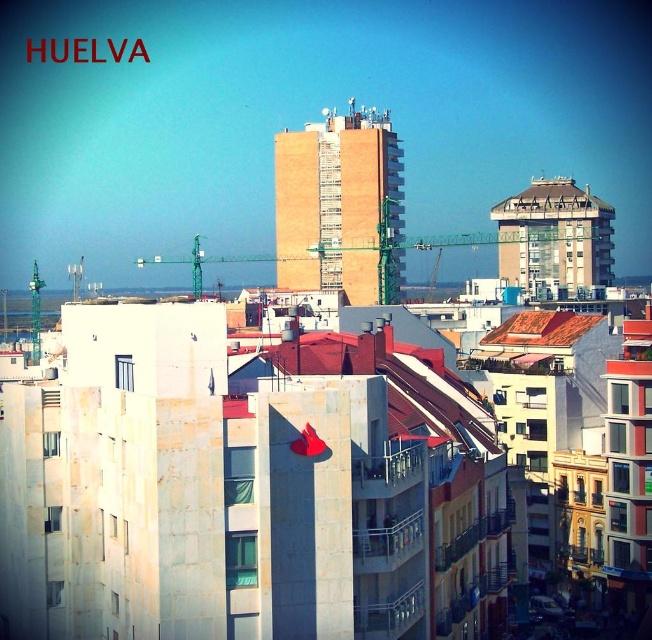
Measure the distance between point (381, 113) and camera.

The distance of point (381, 113) from camera is 1214.82 feet.

Where is `brown brick building at center`? The width and height of the screenshot is (652, 640). brown brick building at center is located at coordinates (336, 200).

Is point (372, 280) in front of point (585, 204)?

No, it is behind (585, 204).

I want to click on brown brick building at center, so click(336, 200).

The image size is (652, 640). I want to click on brown brick building at center, so click(336, 200).

Can you confirm if brown brick building at center is positioned to the left of concrete building at center?

Indeed, brown brick building at center is positioned on the left side of concrete building at center.

The image size is (652, 640). In order to click on brown brick building at center in this screenshot , I will do `click(336, 200)`.

Does concrete building at center appear on the left side of white textured roof at upper right?

Correct, you'll find concrete building at center to the left of white textured roof at upper right.

Between concrete building at center and white textured roof at upper right, which one is positioned lower?

concrete building at center is below.

Find the location of a particular element. This screenshot has width=652, height=640. concrete building at center is located at coordinates (554, 240).